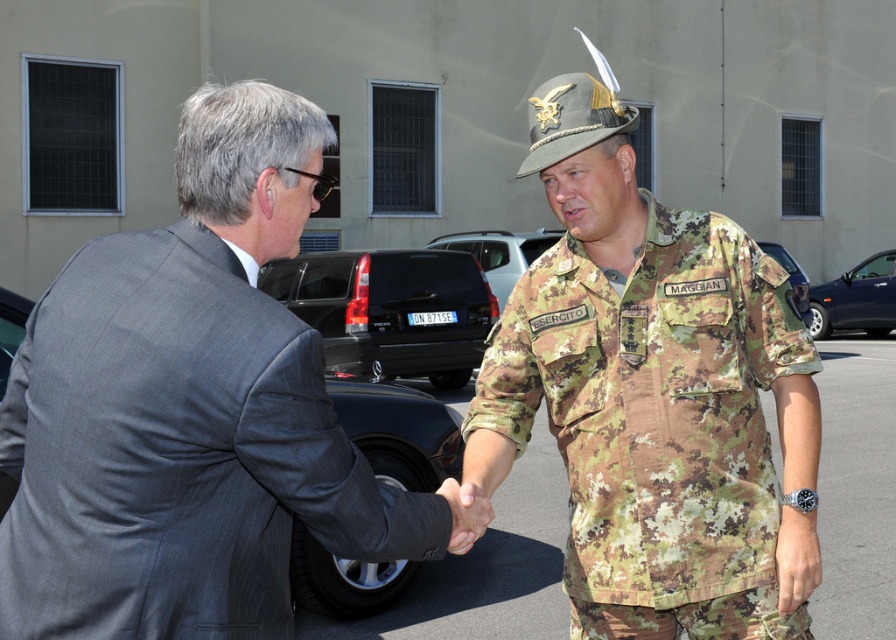
You are standing in the parking lot and see two points marked on the ground. The first point is at coordinates point (152,241) and the second point is at point (545,145). Which point is closer to you?

Point (152,241) is closer to the viewer than point (545,145).

You are a photographer setting up for a formal group photo. The two subjects are wearing the gray pinstripe suit at center and the camouflage fabric uniform at center. You need to ensure there is at least 60 centimeters of space between them for proper lighting. Based on the scene, is the current distance sufficient?

The gray pinstripe suit at center and camouflage fabric uniform at center are 63.73 centimeters apart from each other, which is more than the required 60 centimeters. Therefore, the current distance is sufficient for proper lighting.